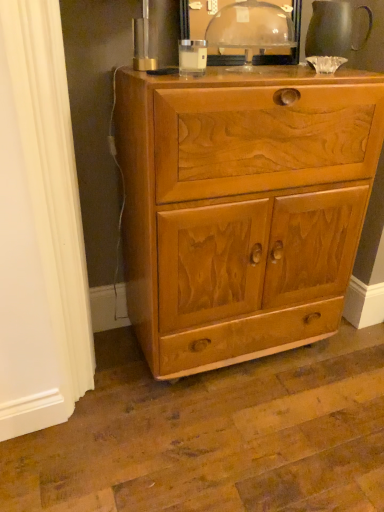
Question: Can you confirm if light brown wood cabinet at center is smaller than matte gray pitcher at upper right?

Choices:
 (A) no
 (B) yes

Answer: (A)

Question: From a real-world perspective, is light brown wood cabinet at center physically below matte gray pitcher at upper right?

Choices:
 (A) yes
 (B) no

Answer: (A)

Question: Is light brown wood cabinet at center next to matte gray pitcher at upper right?

Choices:
 (A) yes
 (B) no

Answer: (B)

Question: From the image's perspective, is light brown wood cabinet at center over matte gray pitcher at upper right?

Choices:
 (A) no
 (B) yes

Answer: (A)

Question: From a real-world perspective, is light brown wood cabinet at center over matte gray pitcher at upper right?

Choices:
 (A) yes
 (B) no

Answer: (B)

Question: Is light brown wood cabinet at center spatially inside matte gray pitcher at upper right, or outside of it?

Choices:
 (A) outside
 (B) inside

Answer: (A)

Question: From the image's perspective, is light brown wood cabinet at center positioned above or below matte gray pitcher at upper right?

Choices:
 (A) above
 (B) below

Answer: (B)

Question: Considering the positions of point (319, 222) and point (322, 52), is point (319, 222) closer or farther from the camera than point (322, 52)?

Choices:
 (A) farther
 (B) closer

Answer: (A)

Question: Relative to matte gray pitcher at upper right, is light brown wood cabinet at center in front or behind?

Choices:
 (A) front
 (B) behind

Answer: (A)

Question: Is light brown wood cabinet at center in front of or behind transparent plastic dome at upper center in the image?

Choices:
 (A) front
 (B) behind

Answer: (A)

Question: In terms of width, does light brown wood cabinet at center look wider or thinner when compared to transparent plastic dome at upper center?

Choices:
 (A) wide
 (B) thin

Answer: (A)

Question: Is light brown wood cabinet at center spatially inside transparent plastic dome at upper center, or outside of it?

Choices:
 (A) inside
 (B) outside

Answer: (B)

Question: Considering the positions of light brown wood cabinet at center and transparent plastic dome at upper center in the image, is light brown wood cabinet at center taller or shorter than transparent plastic dome at upper center?

Choices:
 (A) tall
 (B) short

Answer: (A)

Question: Considering the positions of transparent plastic dome at upper center and light brown wood cabinet at center in the image, is transparent plastic dome at upper center taller or shorter than light brown wood cabinet at center?

Choices:
 (A) short
 (B) tall

Answer: (A)

Question: Does point (233, 67) appear closer or farther from the camera than point (226, 246)?

Choices:
 (A) closer
 (B) farther

Answer: (B)